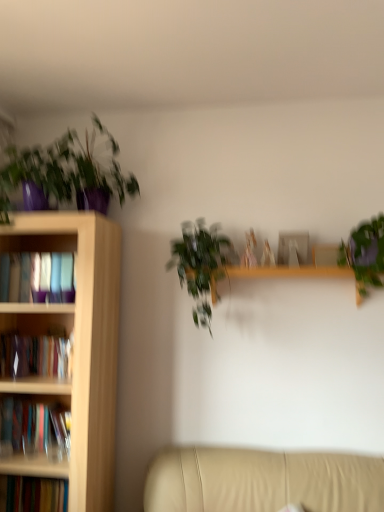
Question: Would you say green leafy plant at center, which appears as the 3th houseplant when viewed from the left, contains beige leather couch at lower right?

Choices:
 (A) no
 (B) yes

Answer: (A)

Question: Considering the relative sizes of green leafy plant at center, which ranks as the second houseplant in right-to-left order, and beige leather couch at lower right in the image provided, is green leafy plant at center, which ranks as the second houseplant in right-to-left order, shorter than beige leather couch at lower right?

Choices:
 (A) no
 (B) yes

Answer: (A)

Question: Considering the relative sizes of green leafy plant at center, which appears as the 3th houseplant when viewed from the left, and beige leather couch at lower right in the image provided, is green leafy plant at center, which appears as the 3th houseplant when viewed from the left, bigger than beige leather couch at lower right?

Choices:
 (A) yes
 (B) no

Answer: (B)

Question: Is green leafy plant at center, which appears as the 3th houseplant when viewed from the left, smaller than beige leather couch at lower right?

Choices:
 (A) no
 (B) yes

Answer: (B)

Question: Does green leafy plant at center, which ranks as the second houseplant in right-to-left order, turn towards beige leather couch at lower right?

Choices:
 (A) no
 (B) yes

Answer: (A)

Question: From the image's perspective, is matte purple pot at upper left, which is the 2th houseplant from left to right, positioned above or below matte purple pot at upper left, marked as the fourth houseplant in a right-to-left arrangement?

Choices:
 (A) above
 (B) below

Answer: (A)

Question: From a real-world perspective, relative to matte purple pot at upper left, which is the 1th houseplant in left-to-right order, is matte purple pot at upper left, which is the 2th houseplant from left to right, vertically above or below?

Choices:
 (A) below
 (B) above

Answer: (B)

Question: From their relative heights in the image, would you say matte purple pot at upper left, which is counted as the third houseplant, starting from the right, is taller or shorter than matte purple pot at upper left, which is the 1th houseplant in left-to-right order?

Choices:
 (A) tall
 (B) short

Answer: (A)

Question: Is point (44, 170) closer or farther from the camera than point (3, 181)?

Choices:
 (A) closer
 (B) farther

Answer: (B)

Question: In the image, is green matte plant at upper right, the first houseplant viewed from the right, on the left side or the right side of matte purple pot at upper left, which is the 1th houseplant in left-to-right order?

Choices:
 (A) right
 (B) left

Answer: (A)

Question: From a real-world perspective, is green matte plant at upper right, which is counted as the fourth houseplant, starting from the left, positioned above or below matte purple pot at upper left, which is the 1th houseplant in left-to-right order?

Choices:
 (A) below
 (B) above

Answer: (A)

Question: Is green matte plant at upper right, the first houseplant viewed from the right, wider or thinner than matte purple pot at upper left, marked as the fourth houseplant in a right-to-left arrangement?

Choices:
 (A) wide
 (B) thin

Answer: (B)

Question: From the image's perspective, is green matte plant at upper right, which is counted as the fourth houseplant, starting from the left, positioned above or below matte purple pot at upper left, marked as the fourth houseplant in a right-to-left arrangement?

Choices:
 (A) above
 (B) below

Answer: (B)

Question: Is wooden bookcase at left situated inside green leafy plant at center, which ranks as the second houseplant in right-to-left order, or outside?

Choices:
 (A) outside
 (B) inside

Answer: (A)

Question: Relative to green leafy plant at center, which ranks as the second houseplant in right-to-left order, is wooden bookcase at left in front or behind?

Choices:
 (A) behind
 (B) front

Answer: (B)